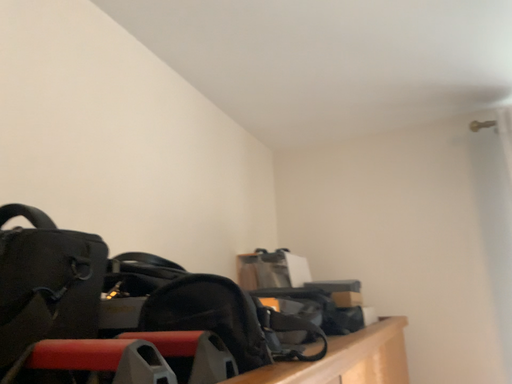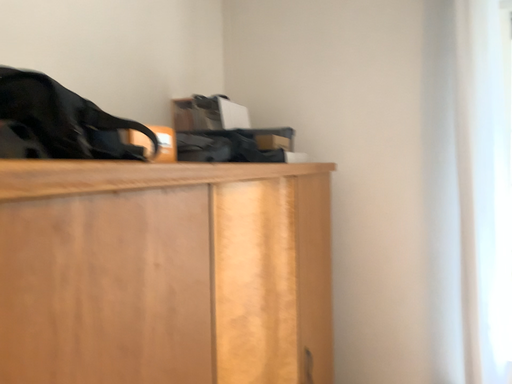
Question: Which way did the camera rotate in the video?

Choices:
 (A) rotated downward
 (B) rotated upward

Answer: (A)